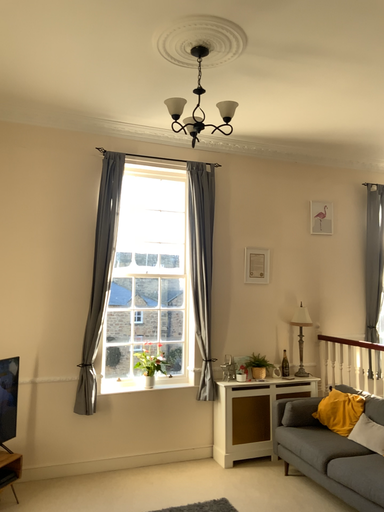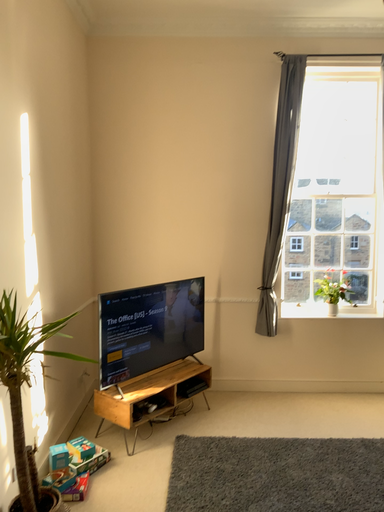
Question: Which way did the camera rotate in the video?

Choices:
 (A) rotated left
 (B) rotated right

Answer: (A)